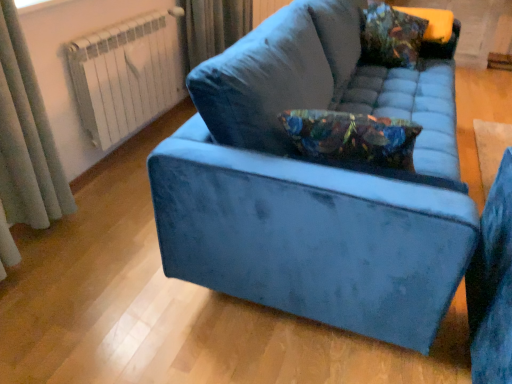
Describe the element at coordinates (125, 75) in the screenshot. I see `white metal radiator at upper left` at that location.

The height and width of the screenshot is (384, 512). I want to click on white metal radiator at upper left, so click(x=125, y=75).

From a real-world perspective, is velvet blue couch at center positioned above or below floral-patterned velvet pillow at upper right?

In terms of real-world spatial position, velvet blue couch at center is below floral-patterned velvet pillow at upper right.

Looking at this image, would you say velvet blue couch at center is to the left or to the right of floral-patterned velvet pillow at upper right in the picture?

velvet blue couch at center is positioned on floral-patterned velvet pillow at upper right's left side.

Does velvet blue couch at center contain floral-patterned velvet pillow at upper right?

Yes, velvet blue couch at center is surrounding floral-patterned velvet pillow at upper right.

Consider the image. Are velvet blue couch at center and floral-patterned velvet pillow at upper right beside each other?

velvet blue couch at center and floral-patterned velvet pillow at upper right are not in contact.

From a real-world perspective, who is located lower, gray fabric curtain at left or floral-patterned velvet pillow at upper right?

gray fabric curtain at left, from a real-world perspective.

Considering the relative sizes of gray fabric curtain at left and floral-patterned velvet pillow at upper right in the image provided, is gray fabric curtain at left shorter than floral-patterned velvet pillow at upper right?

No, gray fabric curtain at left is not shorter than floral-patterned velvet pillow at upper right.

Is gray fabric curtain at left thinner than floral-patterned velvet pillow at upper right?

Yes.

Which is more to the right, velvet blue couch at center or gray fabric curtain at left?

velvet blue couch at center.

Considering the sizes of objects velvet blue couch at center and gray fabric curtain at left in the image provided, who is thinner, velvet blue couch at center or gray fabric curtain at left?

gray fabric curtain at left is thinner.

Do you think velvet blue couch at center is within gray fabric curtain at left, or outside of it?

velvet blue couch at center cannot be found inside gray fabric curtain at left.

Is point (148, 99) closer or farther from the camera than point (12, 34)?

Point (148, 99).

Is white metal radiator at upper left directly adjacent to gray fabric curtain at left?

white metal radiator at upper left and gray fabric curtain at left are not in contact.

Is white metal radiator at upper left smaller than gray fabric curtain at left?

No, white metal radiator at upper left is not smaller than gray fabric curtain at left.

From a real-world perspective, between floral-patterned velvet pillow at upper right and gray fabric curtain at left, who is vertically higher?

floral-patterned velvet pillow at upper right is physically above.

You are a GUI agent. You are given a task and a screenshot of the screen. Output one action in this format:
    pyautogui.click(x=<x>, y=<y>)
    Task: Click on the curtain beneath the floral-patterned velvet pillow at upper right (from a real-world perspective)
    This screenshot has width=512, height=384.
    Given the screenshot: What is the action you would take?
    pyautogui.click(x=32, y=115)

Is gray fabric curtain at left at the back of floral-patterned velvet pillow at upper right?

No, floral-patterned velvet pillow at upper right is not facing the opposite direction of gray fabric curtain at left.

Would you say white metal radiator at upper left is outside floral-patterned velvet pillow at upper right?

That's correct, white metal radiator at upper left is outside of floral-patterned velvet pillow at upper right.

Does point (92, 38) come closer to viewer compared to point (405, 59)?

Yes.

Can you confirm if white metal radiator at upper left is shorter than floral-patterned velvet pillow at upper right?

In fact, white metal radiator at upper left may be taller than floral-patterned velvet pillow at upper right.

From a real-world perspective, is white metal radiator at upper left over floral-patterned velvet pillow at upper right?

Actually, white metal radiator at upper left is physically below floral-patterned velvet pillow at upper right in the real world.

Which of these two, gray fabric curtain at left or velvet blue couch at center, stands shorter?

velvet blue couch at center is shorter.

Does point (46, 148) lie in front of point (206, 160)?

No, (46, 148) is further to viewer.

From a real-world perspective, is gray fabric curtain at left positioned over velvet blue couch at center based on gravity?

Yes, from a real-world perspective, gray fabric curtain at left is over velvet blue couch at center

Is gray fabric curtain at left positioned beyond the bounds of velvet blue couch at center?

Yes, gray fabric curtain at left is located beyond the bounds of velvet blue couch at center.

Where is `throw pillow that is above the velvet blue couch at center (from a real-world perspective)`? Image resolution: width=512 pixels, height=384 pixels. throw pillow that is above the velvet blue couch at center (from a real-world perspective) is located at coordinates (390, 36).

Where is `curtain that is below the floral-patterned velvet pillow at upper right (from the image's perspective)`? The image size is (512, 384). curtain that is below the floral-patterned velvet pillow at upper right (from the image's perspective) is located at coordinates (32, 115).

Based on their spatial positions, is white metal radiator at upper left or gray fabric curtain at left closer to velvet blue couch at center?

Based on the image, gray fabric curtain at left appears to be nearer to velvet blue couch at center.

Based on the photo, estimate the real-world distances between objects in this image. Which object is further from gray fabric curtain at left, velvet blue couch at center or floral-patterned velvet pillow at upper right?

Based on the image, floral-patterned velvet pillow at upper right appears to be further to gray fabric curtain at left.

Looking at the image, which one is located closer to floral-patterned velvet pillow at upper right, white metal radiator at upper left or velvet blue couch at center?

velvet blue couch at center.

From the image, which object appears to be farther from floral-patterned velvet pillow at upper right, gray fabric curtain at left or velvet blue couch at center?

gray fabric curtain at left is positioned further to the anchor floral-patterned velvet pillow at upper right.

When comparing their distances from white metal radiator at upper left, does floral-patterned velvet pillow at upper right or velvet blue couch at center seem further?

Among the two, floral-patterned velvet pillow at upper right is located further to white metal radiator at upper left.

Considering their positions, is velvet blue couch at center positioned closer to gray fabric curtain at left than white metal radiator at upper left?

white metal radiator at upper left lies closer to gray fabric curtain at left than the other object.

From the image, which object appears to be nearer to floral-patterned velvet pillow at upper right, velvet blue couch at center or white metal radiator at upper left?

The object closer to floral-patterned velvet pillow at upper right is velvet blue couch at center.

Based on the photo, considering their positions, is gray fabric curtain at left positioned closer to velvet blue couch at center than floral-patterned velvet pillow at upper right?

Among the two, floral-patterned velvet pillow at upper right is located nearer to velvet blue couch at center.

This screenshot has height=384, width=512. I want to click on studio couch between gray fabric curtain at left and floral-patterned velvet pillow at upper right, so click(315, 184).

Where is `radiator between gray fabric curtain at left and floral-patterned velvet pillow at upper right in the horizontal direction`? radiator between gray fabric curtain at left and floral-patterned velvet pillow at upper right in the horizontal direction is located at coordinates (125, 75).

The height and width of the screenshot is (384, 512). Find the location of `studio couch between white metal radiator at upper left and floral-patterned velvet pillow at upper right in the horizontal direction`. studio couch between white metal radiator at upper left and floral-patterned velvet pillow at upper right in the horizontal direction is located at coordinates (315, 184).

This screenshot has height=384, width=512. Find the location of `radiator between gray fabric curtain at left and velvet blue couch at center from left to right`. radiator between gray fabric curtain at left and velvet blue couch at center from left to right is located at coordinates (125, 75).